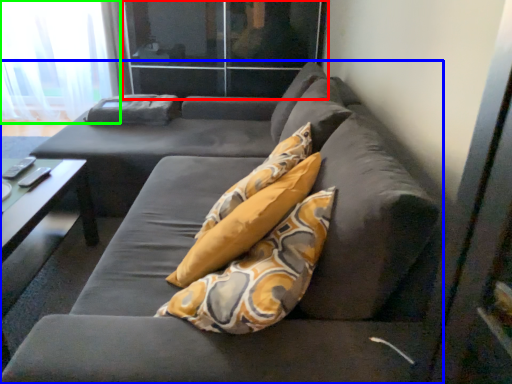
Question: Which is farther away from glass door (highlighted by a red box)? studio couch (highlighted by a blue box) or curtain (highlighted by a green box)?

Choices:
 (A) studio couch
 (B) curtain

Answer: (A)